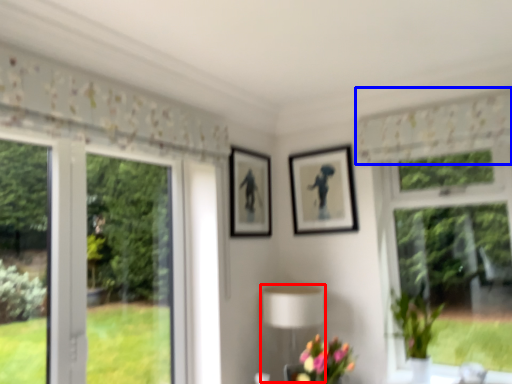
Question: Which object is further to the camera taking this photo, table lamp (highlighted by a red box) or curtain (highlighted by a blue box)?

Choices:
 (A) table lamp
 (B) curtain

Answer: (A)